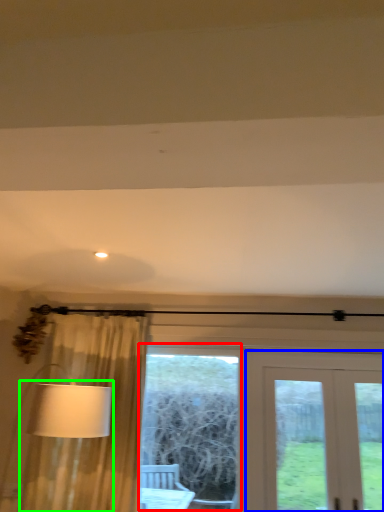
Question: Which object is the farthest from bay window (highlighted by a red box)? Choose among these: door (highlighted by a blue box) or table lamp (highlighted by a green box).

Choices:
 (A) door
 (B) table lamp

Answer: (B)